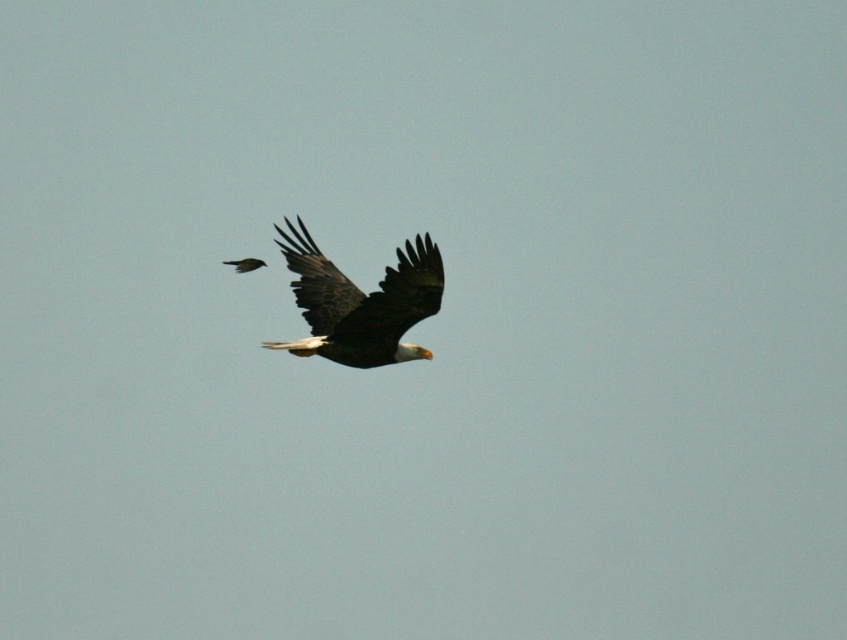
Question: Can you confirm if white-feathered bald eagle at center is positioned below dark brown feathers at center?

Choices:
 (A) no
 (B) yes

Answer: (B)

Question: Can you confirm if white-feathered bald eagle at center is positioned to the left of dark brown feathers at center?

Choices:
 (A) no
 (B) yes

Answer: (A)

Question: Can you confirm if white-feathered bald eagle at center is positioned above dark brown feathers at center?

Choices:
 (A) no
 (B) yes

Answer: (A)

Question: Which object is farther from the camera taking this photo?

Choices:
 (A) dark brown feathers at center
 (B) white-feathered bald eagle at center

Answer: (A)

Question: Which point is farther to the camera?

Choices:
 (A) white-feathered bald eagle at center
 (B) dark brown feathers at center

Answer: (B)